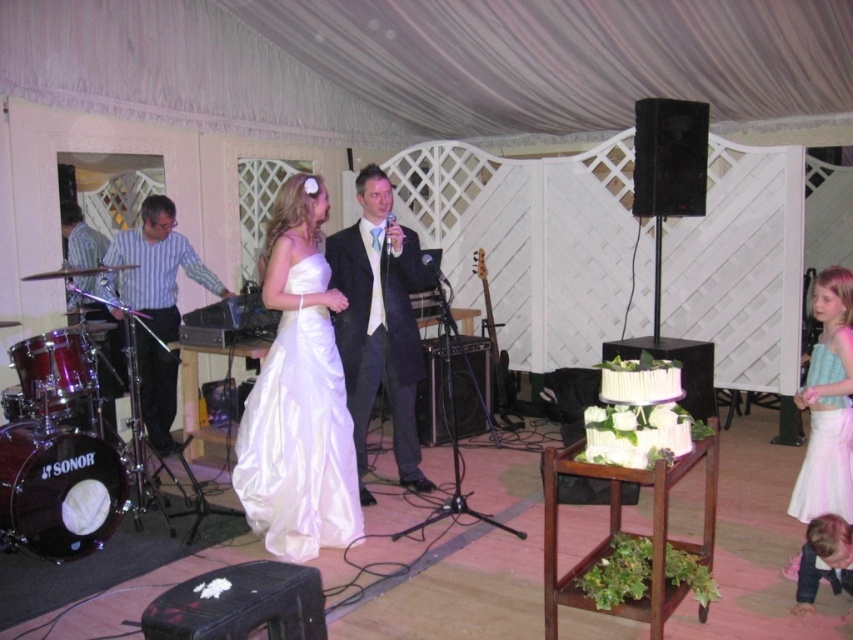
Is white satin dress at right shorter than shiny silver drum set at left?

Correct, white satin dress at right is not as tall as shiny silver drum set at left.

Between point (850, 461) and point (97, 288), which one is positioned in front?

Positioned in front is point (850, 461).

Where is `white satin dress at right`? The image size is (853, 640). white satin dress at right is located at coordinates (825, 442).

Is matte black suit at center further to camera compared to striped fabric shirt at left?

No, matte black suit at center is in front of striped fabric shirt at left.

Does point (381, 365) come farther from viewer compared to point (120, 234)?

No, it is in front of (120, 234).

Where is `matte black suit at center`? This screenshot has height=640, width=853. matte black suit at center is located at coordinates (379, 323).

Does white satin dress at center have a larger size compared to matte black suit at center?

Actually, white satin dress at center might be smaller than matte black suit at center.

I want to click on white satin dress at center, so click(x=299, y=442).

Locate an element on the screen. The image size is (853, 640). white satin dress at center is located at coordinates (299, 442).